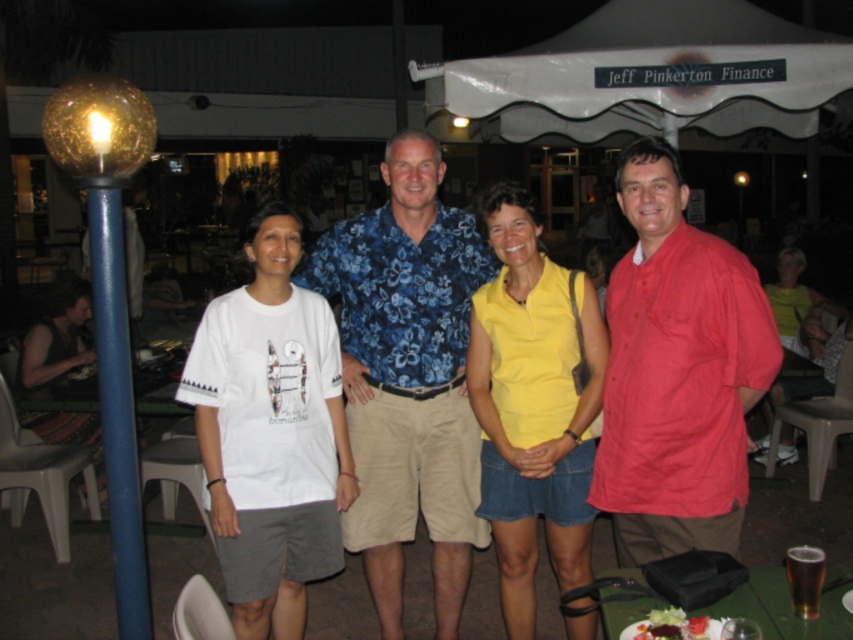
Question: Among these objects, which one is farthest from the camera?

Choices:
 (A) floral print shirt at center
 (B) white cotton t-shirt at left
 (C) green plastic table at lower right
 (D) red cotton shirt at right

Answer: (B)

Question: Is white matte t-shirt at center wider than shiny glass globe at left?

Choices:
 (A) no
 (B) yes

Answer: (B)

Question: Is floral print shirt at center below white cotton t-shirt at left?

Choices:
 (A) no
 (B) yes

Answer: (A)

Question: Can you confirm if white fabric canopy at upper center is positioned to the right of yellow matte shirt at center?

Choices:
 (A) no
 (B) yes

Answer: (B)

Question: Which object is the farthest from the floral print shirt at center?

Choices:
 (A) white cotton t-shirt at left
 (B) red cotton shirt at right
 (C) yellow fabric top at center
 (D) white matte t-shirt at center

Answer: (C)

Question: Considering the real-world distances, which object is farthest from the shiny glass globe at left?

Choices:
 (A) yellow fabric top at center
 (B) white cotton t-shirt at left

Answer: (A)